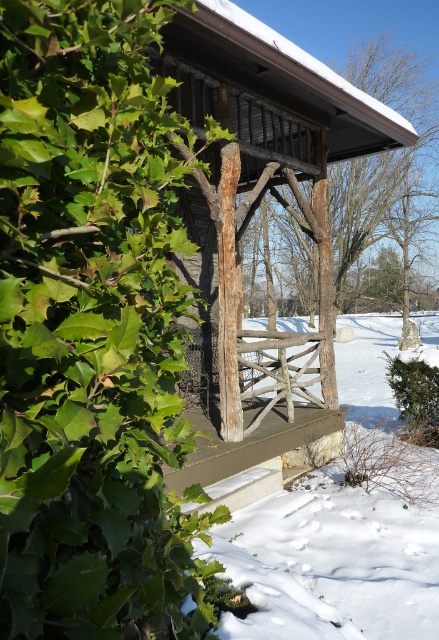
You are an architect designing a winter garden scene. You need to place a small wooden bench between the rustic wooden fence post at center and the green leafy bush at lower right. Which object should the bench be closer to if it needs to be near the larger object?

The bench should be closer to the rustic wooden fence post at center because it is larger than the green leafy bush at lower right.

You are standing at the origin point of the image coordinate system, which is the bottom left corner. You want to walk towards the rustic wooden porch at center. In which direction should you move relative to your current position?

Since the rustic wooden porch at center is located at coordinate point (263, 416), you should move northeast to reach it from the origin point at the bottom left corner.

You are designing a garden layout and need to place both the rustic wooden fence post at center and the green leafy bush at lower right. Since space is limited, which object requires more horizontal space due to its greater width?

The rustic wooden fence post at center requires more horizontal space because its width surpasses that of the green leafy bush at lower right.